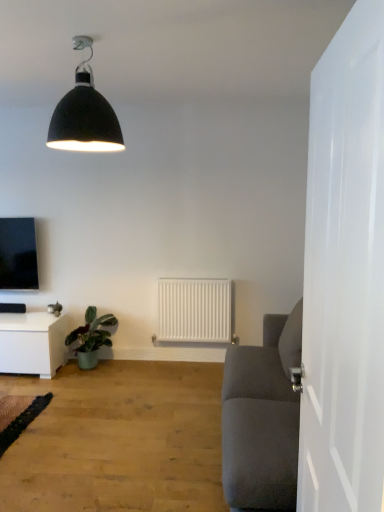
The image size is (384, 512). Identify the location of vacant area that lies to the right of green glossy plant at lower left. (121, 370).